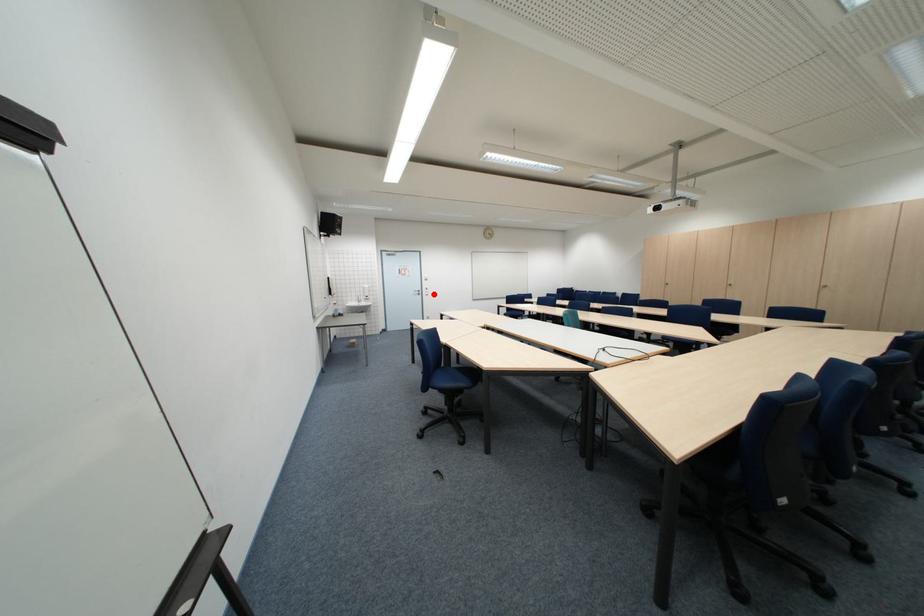
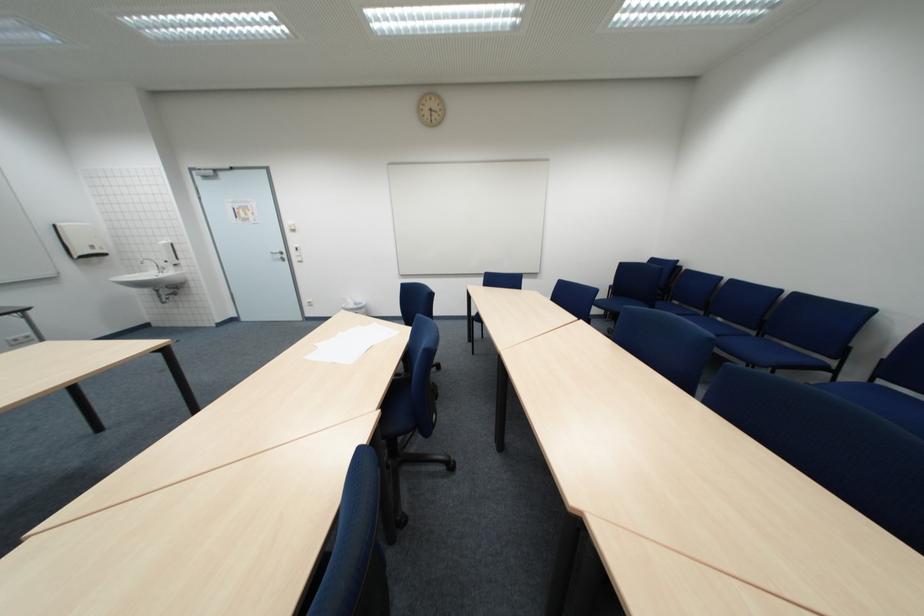
Question: I am providing you with two images of the same scene from different viewpoints. Image1 has a red point marked. In image2, the corresponding 3D location appears at what relative position? Reply with the corresponding letter.

Choices:
 (A) Closer
 (B) Farther

Answer: (B)